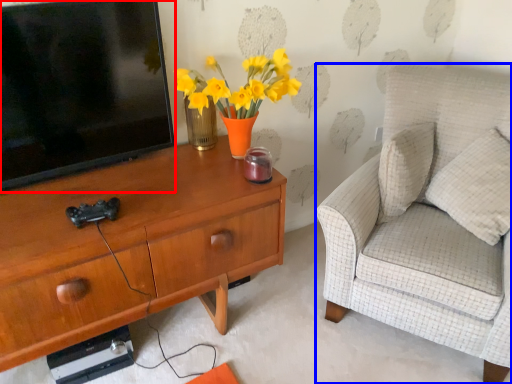
Question: Which object is closer to the camera taking this photo, television (highlighted by a red box) or chair (highlighted by a blue box)?

Choices:
 (A) television
 (B) chair

Answer: (B)